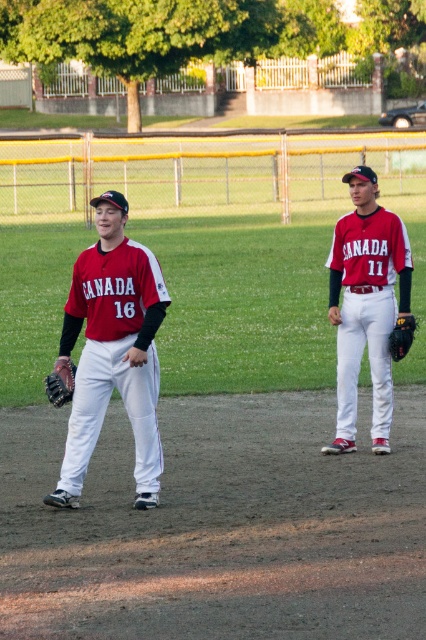
Question: Based on their relative distances, which object is nearer to the brown leather glove at left?

Choices:
 (A) matte red baseball uniform at center
 (B) matte red baseball uniform at right

Answer: (A)

Question: Does matte red baseball uniform at right have a smaller size compared to brown leather glove at left?

Choices:
 (A) yes
 (B) no

Answer: (B)

Question: Estimate the real-world distances between objects in this image. Which object is farther from the matte red jersey at left?

Choices:
 (A) matte red baseball uniform at right
 (B) matte red baseball uniform at center

Answer: (A)

Question: Is matte red jersey at left closer to the viewer compared to black leather glove at right?

Choices:
 (A) no
 (B) yes

Answer: (B)

Question: Is matte red baseball uniform at center positioned behind black leather glove at right?

Choices:
 (A) yes
 (B) no

Answer: (B)

Question: Which of the following is the farthest from the observer?

Choices:
 (A) matte red baseball uniform at center
 (B) brown leather glove at left
 (C) matte red jersey at left
 (D) black leather glove at right

Answer: (D)